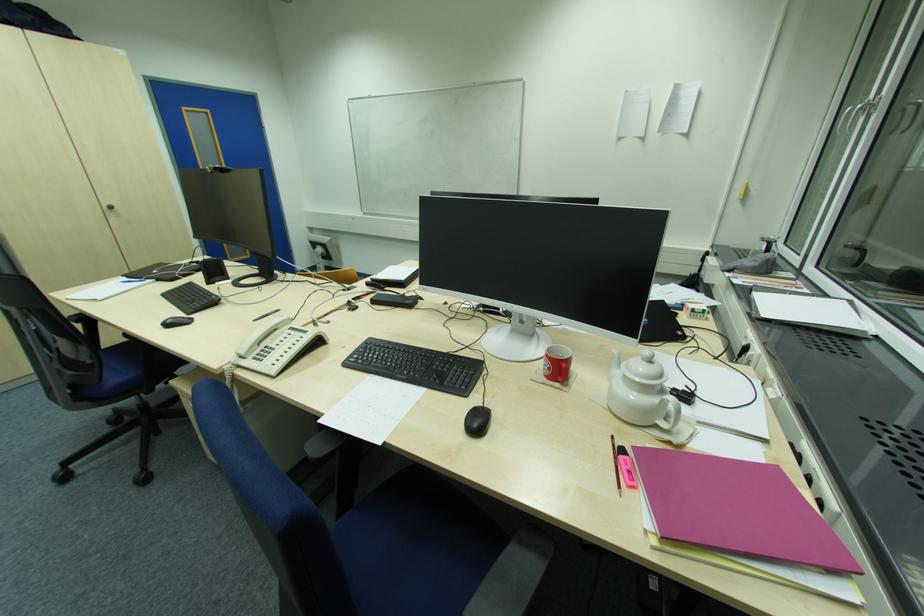
This screenshot has width=924, height=616. What are the coordinates of `white telephone handset` in the screenshot? It's located at (275, 346).